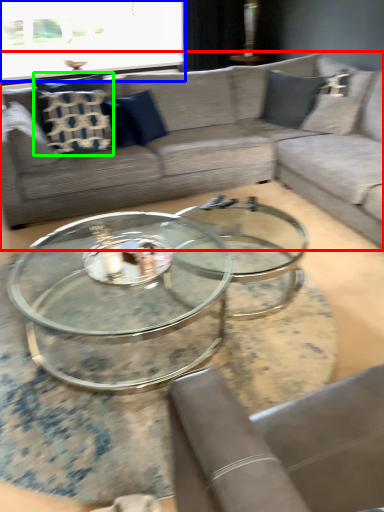
Question: Considering the real-world distances, which object is farthest from studio couch (highlighted by a red box)? window screen (highlighted by a blue box) or pillow (highlighted by a green box)?

Choices:
 (A) window screen
 (B) pillow

Answer: (A)